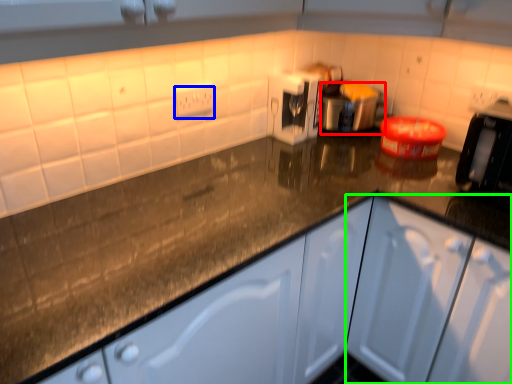
Question: Based on their relative distances, which object is nearer to appliance (highlighted by a red box)? Choose from electric outlet (highlighted by a blue box) and cabinetry (highlighted by a green box).

Choices:
 (A) electric outlet
 (B) cabinetry

Answer: (A)